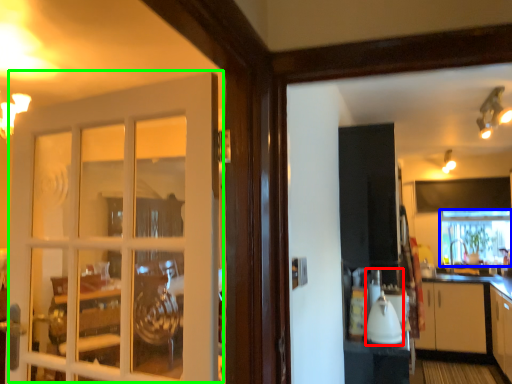
Question: Considering the real-world distances, which object is farthest from appliance (highlighted by a red box)? window frame (highlighted by a blue box) or door (highlighted by a green box)?

Choices:
 (A) window frame
 (B) door

Answer: (A)